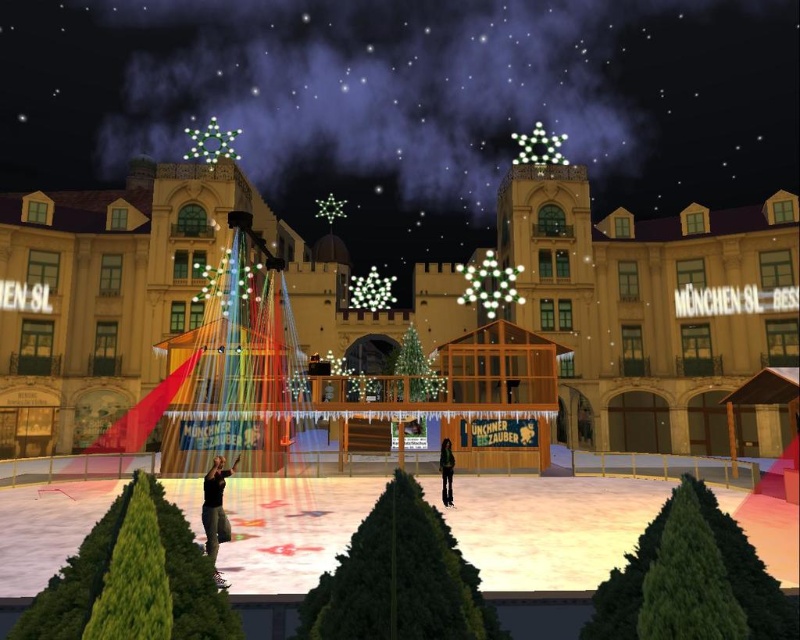
Can you confirm if black leather jacket at lower center is shorter than green fabric pants at center?

In fact, black leather jacket at lower center may be taller than green fabric pants at center.

Can you confirm if black leather jacket at lower center is thinner than green fabric pants at center?

Incorrect, black leather jacket at lower center's width is not less than green fabric pants at center's.

Is point (214, 497) farther from viewer compared to point (448, 499)?

That is False.

Find the location of a particular element. black leather jacket at lower center is located at coordinates (216, 512).